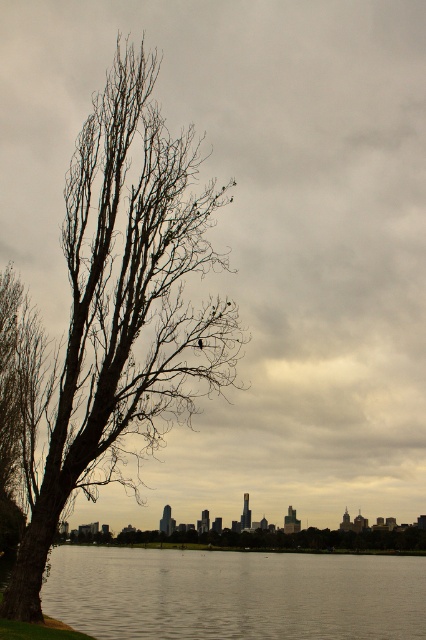
Who is positioned more to the right, bare branches at left or smooth gray water at lower center?

smooth gray water at lower center

Find the location of a particular element. bare branches at left is located at coordinates (124, 308).

Measure the distance between bare branches at left and camera.

bare branches at left and camera are 37.61 meters apart.

Locate an element on the screen. bare branches at left is located at coordinates (124, 308).

Who is more forward, (158, 340) or (412, 545)?

Point (158, 340)

Does bare branches at left appear over bare wood tree at left?

Correct, bare branches at left is located above bare wood tree at left.

The width and height of the screenshot is (426, 640). I want to click on bare branches at left, so click(x=124, y=308).

Locate an element on the screen. The width and height of the screenshot is (426, 640). bare branches at left is located at coordinates (124, 308).

Is point (141, 563) positioned before point (201, 540)?

Yes, point (141, 563) is in front of point (201, 540).

Is smooth gray water at lower center to the left of bare wood tree at left from the viewer's perspective?

Indeed, smooth gray water at lower center is positioned on the left side of bare wood tree at left.

Does point (356, 573) come in front of point (367, 544)?

Yes, point (356, 573) is closer to viewer.

Locate an element on the screen. The height and width of the screenshot is (640, 426). smooth gray water at lower center is located at coordinates (235, 595).